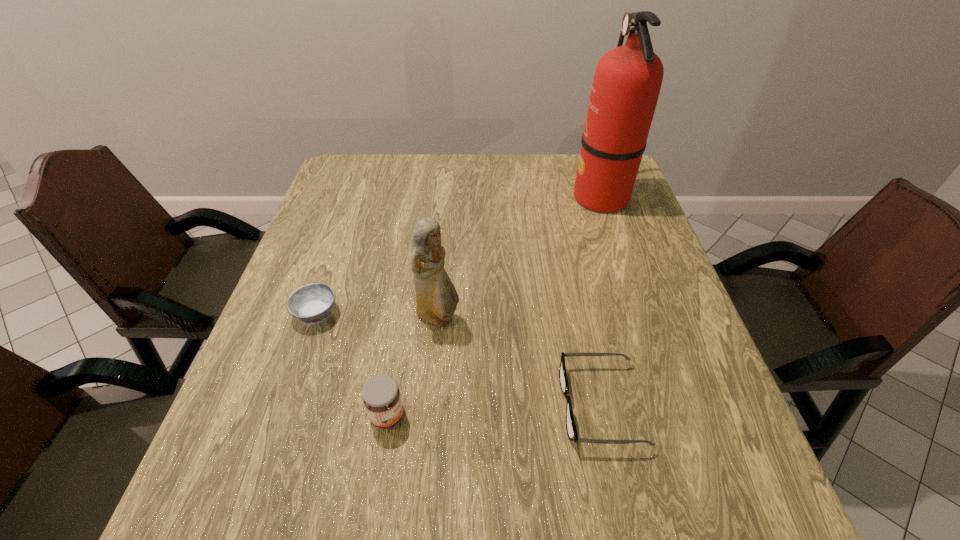
Where is `vacant region between the farthest object and the fourth shortest object`? vacant region between the farthest object and the fourth shortest object is located at coordinates (519, 258).

Locate an element on the screen. The image size is (960, 540). vacant space that is in between the ashtray and the fire extinguisher is located at coordinates (459, 255).

In order to click on free point between the spectacles and the fourth shortest object in this screenshot , I will do `click(519, 361)`.

Where is `free point between the tallest object and the second tallest object`? free point between the tallest object and the second tallest object is located at coordinates (519, 258).

Locate an element on the screen. The width and height of the screenshot is (960, 540). free spot between the fourth shortest object and the third tallest object is located at coordinates (413, 367).

Select which object is the closest to the leftmost object. Please provide its 2D coordinates. Your answer should be formatted as a tuple, i.e. [(x, y)], where the tuple contains the x and y coordinates of a point satisfying the conditions above.

[(436, 297)]

Select which object is the fourth closest to the fourth shortest object. Please provide its 2D coordinates. Your answer should be formatted as a tuple, i.e. [(x, y)], where the tuple contains the x and y coordinates of a point satisfying the conditions above.

[(627, 81)]